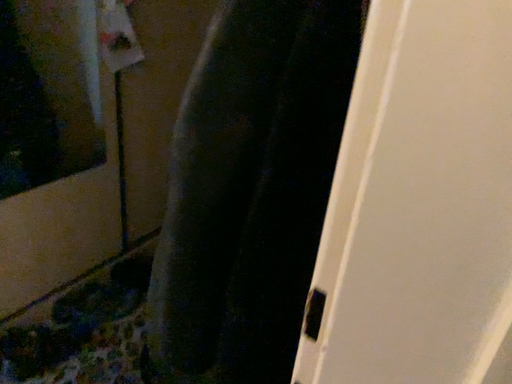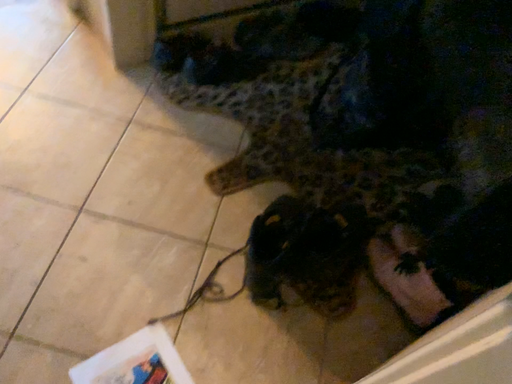
Question: How did the camera likely rotate when shooting the video?

Choices:
 (A) rotated downward
 (B) rotated upward

Answer: (A)